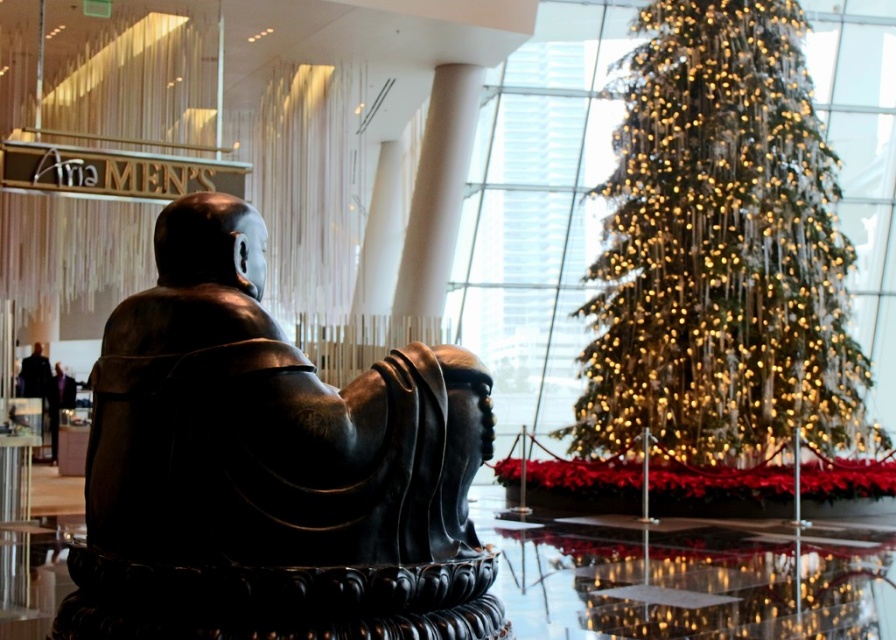
Question: Is bronze statue at left wider than iridescent gold lights at center?

Choices:
 (A) yes
 (B) no

Answer: (B)

Question: Can you confirm if bronze statue at left is positioned below iridescent gold lights at center?

Choices:
 (A) yes
 (B) no

Answer: (B)

Question: Can you confirm if bronze statue at left is positioned to the right of iridescent gold lights at center?

Choices:
 (A) no
 (B) yes

Answer: (A)

Question: Among these objects, which one is nearest to the camera?

Choices:
 (A) iridescent gold lights at center
 (B) bronze statue at left

Answer: (B)